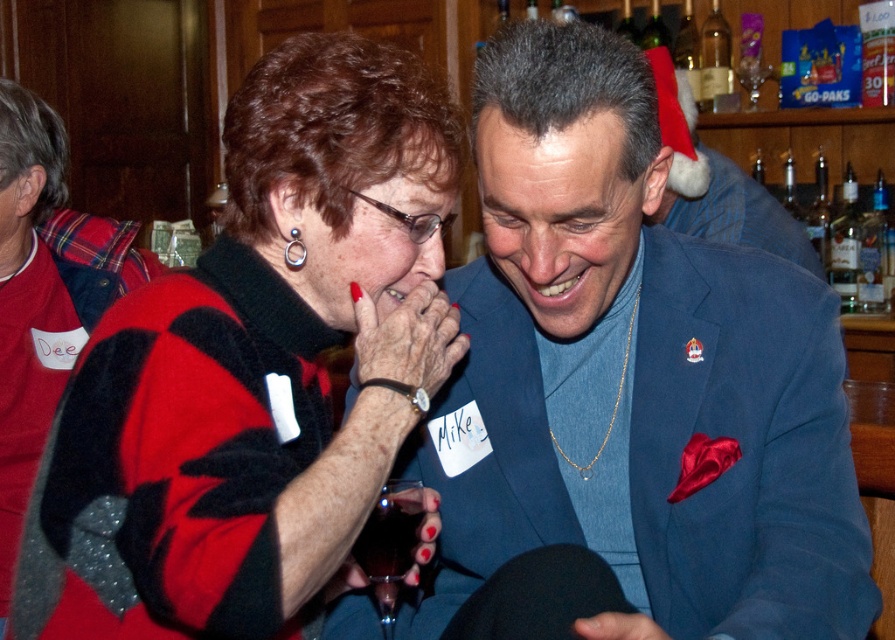
You are a photographer at a party and need to capture a closeup of the blue satin suit at center and the transparent glass at lower center. Since the camera can only focus on one object at a time, which object should you choose to ensure the larger one is in focus?

The blue satin suit at center has a larger size compared to transparent glass at lower center, so you should focus on the blue satin suit at center to ensure the larger object is in focus.